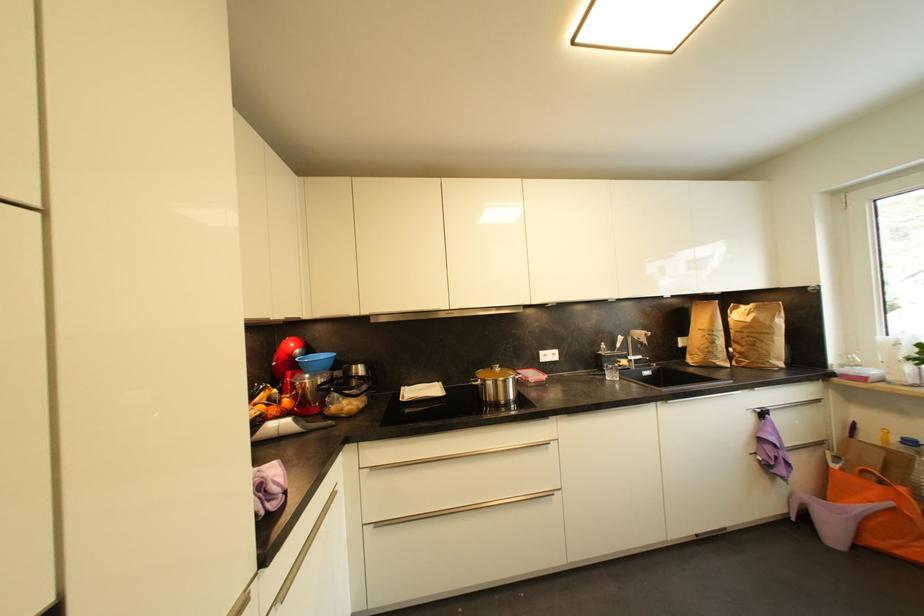
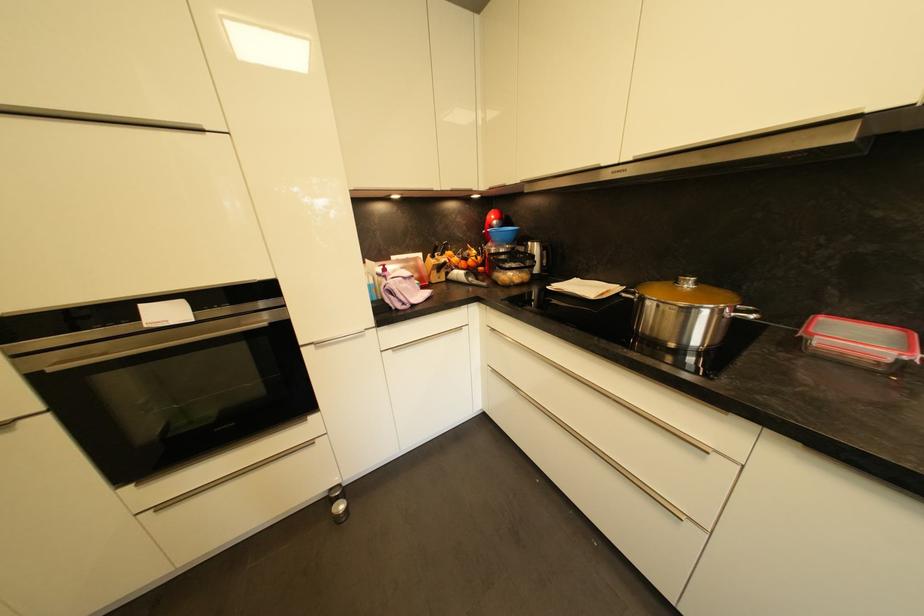
In the second image, find the point that corresponds to (x=277, y=411) in the first image.

(468, 265)